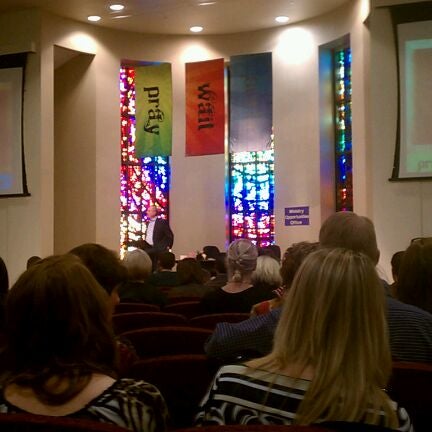
Where is `recessed lighting`? recessed lighting is located at coordinates (285, 20).